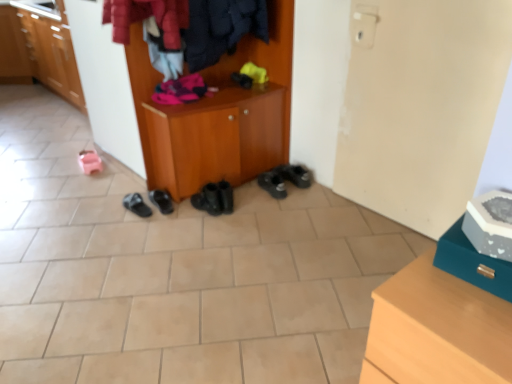
Question: Should I look upward or downward to see velvet-like red coat at upper center?

Choices:
 (A) up
 (B) down

Answer: (A)

Question: Does black rubber sandals at center, placed as the 5th footwear when sorted from right to left, lie behind black rubber shoes at lower right, positioned as the 1th footwear in right-to-left order?

Choices:
 (A) no
 (B) yes

Answer: (A)

Question: From a real-world perspective, is black rubber sandals at center, which appears as the second footwear when viewed from the left, below black rubber shoes at lower right, positioned as the 1th footwear in right-to-left order?

Choices:
 (A) yes
 (B) no

Answer: (A)

Question: From the image's perspective, does black rubber sandals at center, which appears as the second footwear when viewed from the left, appear lower than black rubber shoes at lower right, positioned as the 1th footwear in right-to-left order?

Choices:
 (A) no
 (B) yes

Answer: (B)

Question: Is black rubber sandals at center, placed as the 5th footwear when sorted from right to left, positioned in front of black rubber shoes at lower right, which is the sixth footwear in left-to-right order?

Choices:
 (A) yes
 (B) no

Answer: (A)

Question: Considering the relative positions of black rubber sandals at center, placed as the 5th footwear when sorted from right to left, and black rubber shoes at lower right, which is the sixth footwear in left-to-right order, in the image provided, is black rubber sandals at center, placed as the 5th footwear when sorted from right to left, to the right of black rubber shoes at lower right, which is the sixth footwear in left-to-right order, from the viewer's perspective?

Choices:
 (A) yes
 (B) no

Answer: (B)

Question: Can you confirm if black rubber sandals at center, placed as the 5th footwear when sorted from right to left, is positioned to the left of black rubber shoes at lower right, which is the sixth footwear in left-to-right order?

Choices:
 (A) yes
 (B) no

Answer: (A)

Question: Is black rubber shoes at center, the second footwear in the right-to-left sequence, positioned in front of wooden cabinet at center, which appears as the second cabinetry when viewed from the left?

Choices:
 (A) no
 (B) yes

Answer: (A)

Question: Does black rubber shoes at center, the second footwear in the right-to-left sequence, have a greater width compared to wooden cabinet at center, marked as the first cabinetry in a right-to-left arrangement?

Choices:
 (A) yes
 (B) no

Answer: (B)

Question: Is wooden cabinet at center, which is counted as the second cabinetry, starting from the top, located within black rubber shoes at center, the second footwear in the right-to-left sequence?

Choices:
 (A) yes
 (B) no

Answer: (B)

Question: Does black rubber shoes at center, the second footwear in the right-to-left sequence, have a smaller size compared to wooden cabinet at center, marked as the first cabinetry in a right-to-left arrangement?

Choices:
 (A) yes
 (B) no

Answer: (A)

Question: Is black rubber shoes at center, arranged as the 5th footwear when viewed from the left, touching wooden cabinet at center, which appears as the 1th cabinetry when ordered from the bottom?

Choices:
 (A) no
 (B) yes

Answer: (A)

Question: Is black rubber shoes at center, arranged as the 5th footwear when viewed from the left, oriented towards wooden cabinet at center, which appears as the 1th cabinetry when ordered from the bottom?

Choices:
 (A) yes
 (B) no

Answer: (B)

Question: Is matte wood cabinet at left, the first cabinetry viewed from the back, facing away from black rubber shoes at center, arranged as the 5th footwear when viewed from the left?

Choices:
 (A) no
 (B) yes

Answer: (A)